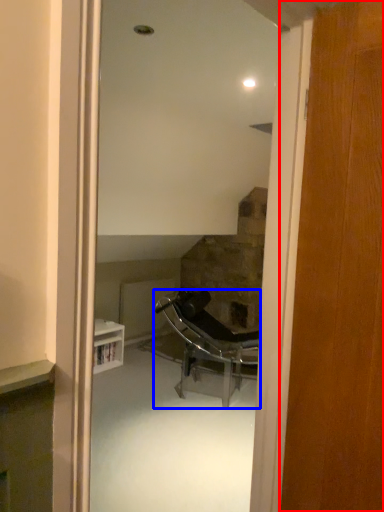
Question: Which of the following is the closest to the observer, door (highlighted by a red box) or chair (highlighted by a blue box)?

Choices:
 (A) door
 (B) chair

Answer: (A)